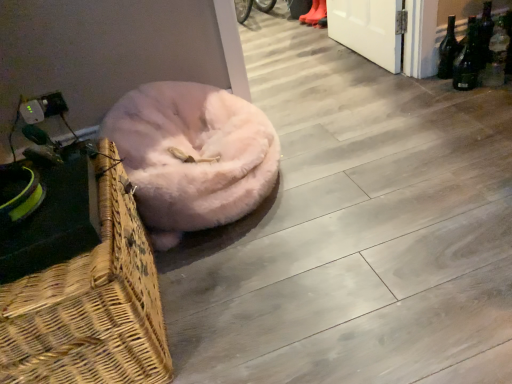
Question: Is orange rubber boots at upper center closer to camera compared to woven wood picnic basket at lower left?

Choices:
 (A) no
 (B) yes

Answer: (A)

Question: Considering the relative positions of orange rubber boots at upper center and woven wood picnic basket at lower left in the image provided, is orange rubber boots at upper center behind woven wood picnic basket at lower left?

Choices:
 (A) yes
 (B) no

Answer: (A)

Question: Considering the relative sizes of orange rubber boots at upper center and woven wood picnic basket at lower left in the image provided, is orange rubber boots at upper center thinner than woven wood picnic basket at lower left?

Choices:
 (A) yes
 (B) no

Answer: (A)

Question: Is orange rubber boots at upper center smaller than woven wood picnic basket at lower left?

Choices:
 (A) yes
 (B) no

Answer: (A)

Question: Considering the relative sizes of orange rubber boots at upper center and woven wood picnic basket at lower left in the image provided, is orange rubber boots at upper center taller than woven wood picnic basket at lower left?

Choices:
 (A) yes
 (B) no

Answer: (B)

Question: Visually, is green glass bottle at right, positioned as the 1th bottle in right-to-left order, positioned to the left or to the right of fuzzy pink dog bed at lower left?

Choices:
 (A) left
 (B) right

Answer: (B)

Question: Looking at the image, does green glass bottle at right, positioned as the 1th bottle in right-to-left order, seem bigger or smaller compared to fuzzy pink dog bed at lower left?

Choices:
 (A) small
 (B) big

Answer: (A)

Question: In terms of width, does green glass bottle at right, acting as the third bottle starting from the left, look wider or thinner when compared to fuzzy pink dog bed at lower left?

Choices:
 (A) thin
 (B) wide

Answer: (A)

Question: From a real-world perspective, is green glass bottle at right, acting as the third bottle starting from the left, positioned above or below fuzzy pink dog bed at lower left?

Choices:
 (A) above
 (B) below

Answer: (B)

Question: Considering the positions of orange rubber boots at upper center and green glass bottle at right, positioned as the 1th bottle in right-to-left order, in the image, is orange rubber boots at upper center taller or shorter than green glass bottle at right, positioned as the 1th bottle in right-to-left order,?

Choices:
 (A) short
 (B) tall

Answer: (A)

Question: Looking at their shapes, would you say orange rubber boots at upper center is wider or thinner than green glass bottle at right, acting as the third bottle starting from the left?

Choices:
 (A) thin
 (B) wide

Answer: (B)

Question: In the image, is orange rubber boots at upper center positioned in front of or behind green glass bottle at right, acting as the third bottle starting from the left?

Choices:
 (A) behind
 (B) front

Answer: (A)

Question: Choose the correct answer: Is orange rubber boots at upper center inside green glass bottle at right, positioned as the 1th bottle in right-to-left order, or outside it?

Choices:
 (A) inside
 (B) outside

Answer: (B)

Question: From the image's perspective, relative to dark green glass bottle at upper right, which appears as the 2th bottle when viewed from the left, is green glass bottle at right, positioned as the 1th bottle in right-to-left order, above or below?

Choices:
 (A) above
 (B) below

Answer: (B)

Question: Is point (499, 72) positioned closer to the camera than point (479, 31)?

Choices:
 (A) closer
 (B) farther

Answer: (B)